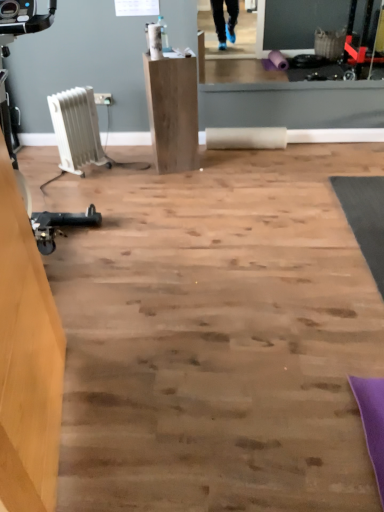
Question: From a real-world perspective, does white plastic heater at left sit lower than white plastic radiator at left?

Choices:
 (A) no
 (B) yes

Answer: (A)

Question: Considering the relative positions of white plastic heater at left and white plastic radiator at left in the image provided, is white plastic heater at left to the right of white plastic radiator at left from the viewer's perspective?

Choices:
 (A) no
 (B) yes

Answer: (A)

Question: Could white plastic radiator at left be considered to be inside white plastic heater at left?

Choices:
 (A) yes
 (B) no

Answer: (A)

Question: Is white plastic heater at left beside white plastic radiator at left?

Choices:
 (A) yes
 (B) no

Answer: (B)

Question: Can you confirm if white plastic heater at left is bigger than white plastic radiator at left?

Choices:
 (A) no
 (B) yes

Answer: (B)

Question: Is white plastic radiator at left in front of or behind white plastic heater at left in the image?

Choices:
 (A) front
 (B) behind

Answer: (B)

Question: Is white plastic radiator at left to the left or to the right of white plastic heater at left in the image?

Choices:
 (A) right
 (B) left

Answer: (A)

Question: Considering the positions of white plastic radiator at left and white plastic heater at left in the image, is white plastic radiator at left wider or thinner than white plastic heater at left?

Choices:
 (A) thin
 (B) wide

Answer: (A)

Question: From a real-world perspective, is white plastic radiator at left above or below white plastic heater at left?

Choices:
 (A) above
 (B) below

Answer: (B)

Question: Would you say natural wood pedestal at center, the 1th furniture viewed from the back, is to the left or to the right of white plastic heater at left in the picture?

Choices:
 (A) left
 (B) right

Answer: (B)

Question: Considering the positions of point (190, 112) and point (4, 123), is point (190, 112) closer or farther from the camera than point (4, 123)?

Choices:
 (A) farther
 (B) closer

Answer: (A)

Question: Is natural wood pedestal at center, arranged as the second furniture when viewed from the left, in front of or behind white plastic heater at left in the image?

Choices:
 (A) behind
 (B) front

Answer: (A)

Question: From a real-world perspective, is natural wood pedestal at center, acting as the 2th furniture starting from the front, physically located above or below white plastic heater at left?

Choices:
 (A) above
 (B) below

Answer: (B)

Question: Is wooden desk at left, arranged as the 1th furniture when viewed from the front, taller or shorter than natural wood pedestal at center, acting as the 1th furniture starting from the right?

Choices:
 (A) tall
 (B) short

Answer: (A)

Question: Considering the positions of point (1, 419) and point (180, 66), is point (1, 419) closer or farther from the camera than point (180, 66)?

Choices:
 (A) closer
 (B) farther

Answer: (A)